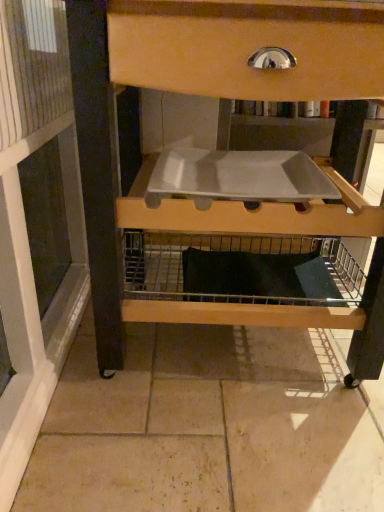
Question: Considering the positions of white plastic tray at center and wooden drawer at upper center in the image, is white plastic tray at center taller or shorter than wooden drawer at upper center?

Choices:
 (A) tall
 (B) short

Answer: (B)

Question: In terms of width, does white plastic tray at center look wider or thinner when compared to wooden drawer at upper center?

Choices:
 (A) wide
 (B) thin

Answer: (B)

Question: From the image's perspective, relative to wooden drawer at upper center, is white plastic tray at center above or below?

Choices:
 (A) above
 (B) below

Answer: (A)

Question: Is wooden drawer at upper center to the left or to the right of white plastic tray at center in the image?

Choices:
 (A) left
 (B) right

Answer: (B)

Question: From the image's perspective, is wooden drawer at upper center located above or below white plastic tray at center?

Choices:
 (A) below
 (B) above

Answer: (A)

Question: Does point (84, 1) appear closer or farther from the camera than point (203, 199)?

Choices:
 (A) farther
 (B) closer

Answer: (B)

Question: In terms of height, does wooden drawer at upper center look taller or shorter compared to white plastic tray at center?

Choices:
 (A) short
 (B) tall

Answer: (B)